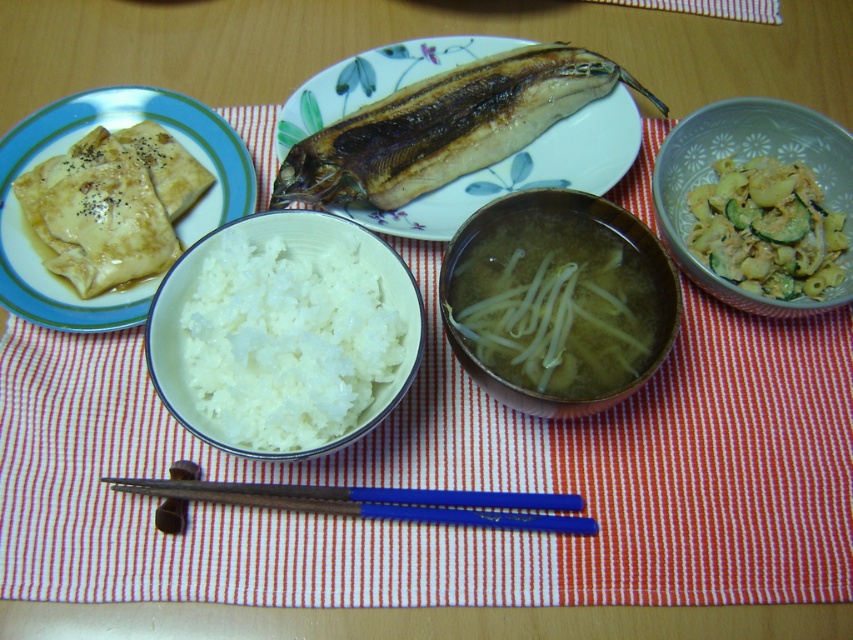
Which is in front, point (262, 392) or point (416, 84)?

Point (262, 392) is more forward.

Can you confirm if white matte rice at center is positioned to the right of grilled brown fish at center?

No, white matte rice at center is not to the right of grilled brown fish at center.

Identify the location of white matte rice at center. (287, 340).

This screenshot has width=853, height=640. I want to click on white matte rice at center, so click(287, 340).

Is matte brown crepes at left shorter than yellowish matte pasta at upper right?

No.

Is matte brown crepes at left behind yellowish matte pasta at upper right?

That is False.

Between point (199, 129) and point (770, 289), which one is positioned behind?

The point (199, 129) is behind.

Locate an element on the screen. matte brown crepes at left is located at coordinates (64, 150).

Does grilled brown fish at center have a greater width compared to blue plastic chopsticks at center?

No.

Which is below, grilled brown fish at center or blue plastic chopsticks at center?

blue plastic chopsticks at center is below.

This screenshot has height=640, width=853. I want to click on grilled brown fish at center, so click(445, 125).

In order to click on grilled brown fish at center in this screenshot , I will do `click(445, 125)`.